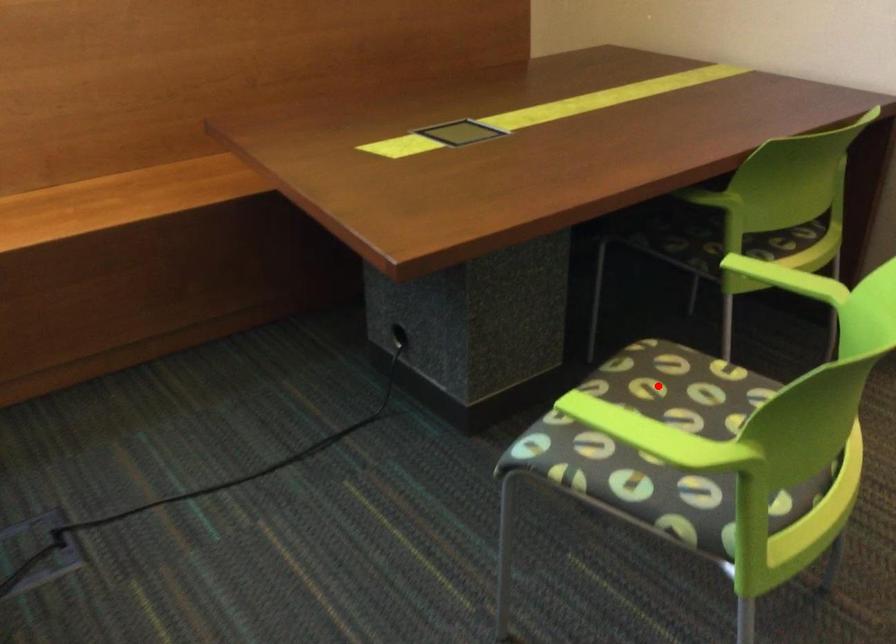
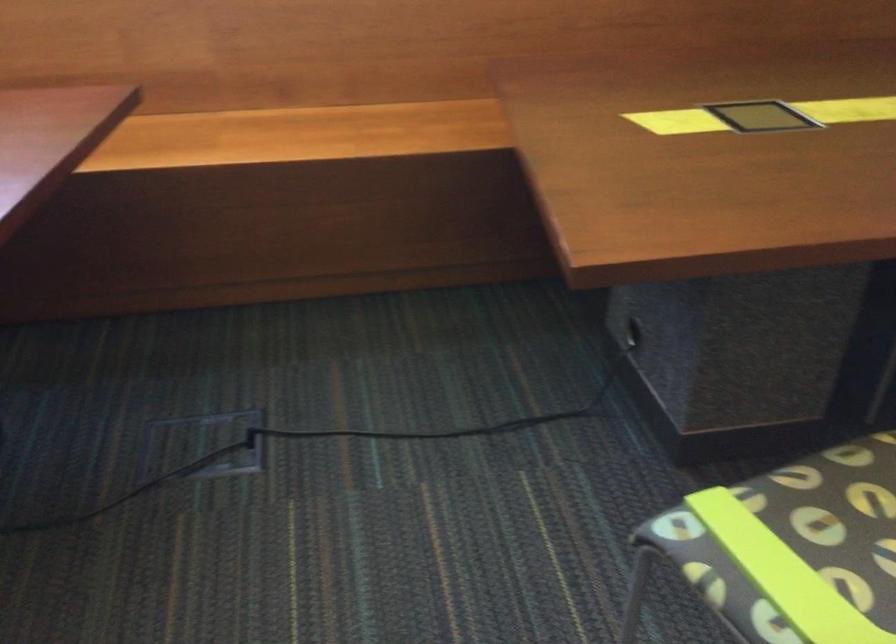
Question: I am providing you with two images of the same scene from different viewpoints. Image1 has a red point marked. In image2, the corresponding 3D location appears at what relative position? Reply with the corresponding letter.

Choices:
 (A) Closer
 (B) Farther

Answer: (A)